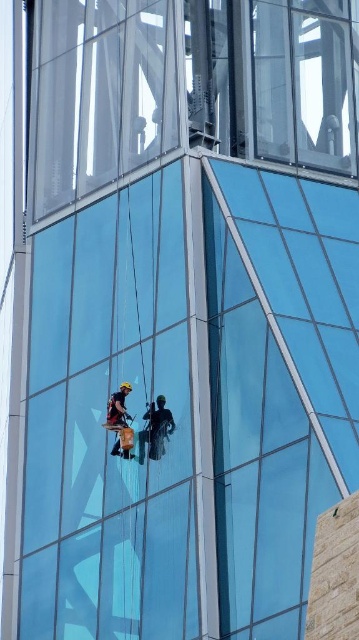
Who is lower down, dark blue fabric at center or reddish-brown fabric harness at center?

dark blue fabric at center is below.

Which is in front, point (150, 412) or point (131, 435)?

Point (150, 412)

At what (x,y) coordinates should I click in order to perform the action: click on dark blue fabric at center. Please return your answer as a coordinate pair (x, y). The image size is (359, 640). Looking at the image, I should click on (156, 429).

The height and width of the screenshot is (640, 359). I want to click on dark blue fabric at center, so click(x=156, y=429).

Between transparent glass window at upper center and reddish-brown fabric harness at center, which one appears on the left side from the viewer's perspective?

Positioned to the left is reddish-brown fabric harness at center.

This screenshot has height=640, width=359. I want to click on transparent glass window at upper center, so click(x=304, y=83).

Identify the location of transparent glass window at upper center. (304, 83).

You are a GUI agent. You are given a task and a screenshot of the screen. Output one action in this format:
    pyautogui.click(x=<x>, y=<y>)
    Task: Click on the transparent glass window at upper center
    Image resolution: width=359 pixels, height=640 pixels.
    Given the screenshot: What is the action you would take?
    pyautogui.click(x=304, y=83)

Based on the photo, who is shorter, transparent glass window at upper center or dark blue fabric at center?

dark blue fabric at center

Which is more to the right, transparent glass window at upper center or dark blue fabric at center?

From the viewer's perspective, transparent glass window at upper center appears more on the right side.

Identify the location of transparent glass window at upper center. The width and height of the screenshot is (359, 640). (304, 83).